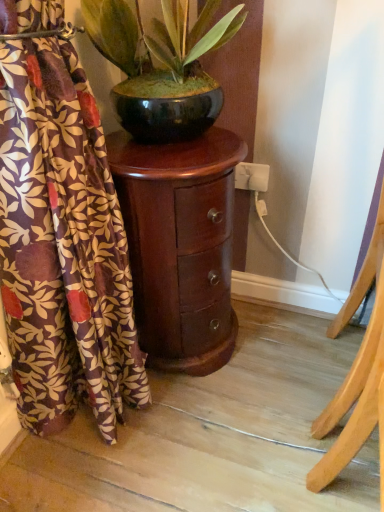
Question: Considering the relative sizes of shiny black pot at upper center and matte floral curtain at left in the image provided, is shiny black pot at upper center taller than matte floral curtain at left?

Choices:
 (A) no
 (B) yes

Answer: (A)

Question: Is shiny black pot at upper center thinner than matte floral curtain at left?

Choices:
 (A) yes
 (B) no

Answer: (B)

Question: Considering the relative positions of shiny black pot at upper center and matte floral curtain at left in the image provided, is shiny black pot at upper center in front of matte floral curtain at left?

Choices:
 (A) no
 (B) yes

Answer: (A)

Question: Is shiny black pot at upper center smaller than matte floral curtain at left?

Choices:
 (A) no
 (B) yes

Answer: (B)

Question: Is shiny black pot at upper center with matte floral curtain at left?

Choices:
 (A) no
 (B) yes

Answer: (A)

Question: From the image's perspective, is shiny black pot at upper center above matte floral curtain at left?

Choices:
 (A) no
 (B) yes

Answer: (B)

Question: Considering the relative sizes of matte floral curtain at left and shiny dark wood nightstand at center in the image provided, is matte floral curtain at left smaller than shiny dark wood nightstand at center?

Choices:
 (A) no
 (B) yes

Answer: (A)

Question: From a real-world perspective, is matte floral curtain at left positioned over shiny dark wood nightstand at center based on gravity?

Choices:
 (A) no
 (B) yes

Answer: (B)

Question: Is matte floral curtain at left facing towards shiny dark wood nightstand at center?

Choices:
 (A) no
 (B) yes

Answer: (A)

Question: Is matte floral curtain at left oriented away from shiny dark wood nightstand at center?

Choices:
 (A) yes
 (B) no

Answer: (B)

Question: Can you confirm if matte floral curtain at left is taller than shiny dark wood nightstand at center?

Choices:
 (A) yes
 (B) no

Answer: (A)

Question: Is matte floral curtain at left to the right of shiny dark wood nightstand at center from the viewer's perspective?

Choices:
 (A) yes
 (B) no

Answer: (B)

Question: Does matte floral curtain at left have a lesser width compared to shiny black pot at upper center?

Choices:
 (A) yes
 (B) no

Answer: (A)